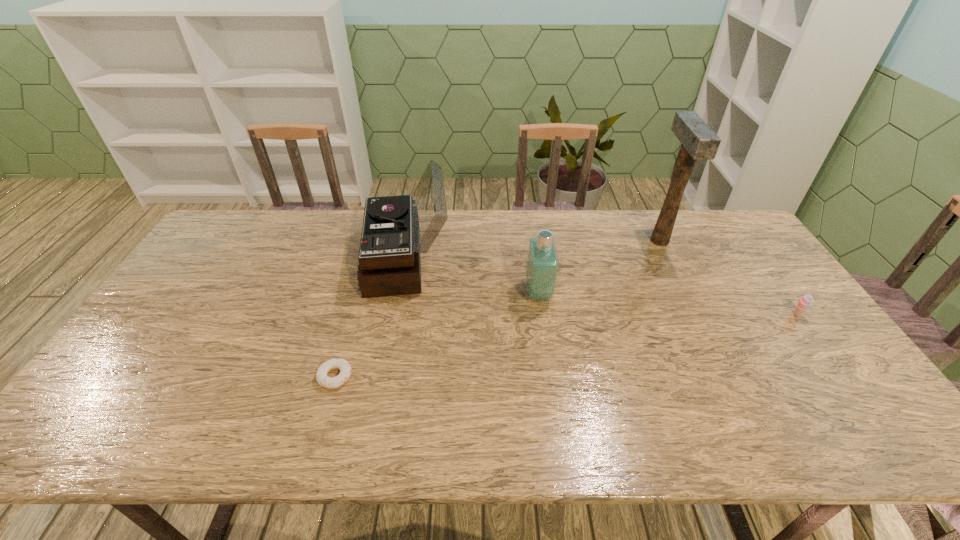
Locate an element on the screen. vacant position in the image that satisfies the following two spatial constraints: 1. on the front label of the sherbert; 2. on the left side of the third object from left to right is located at coordinates (541, 315).

Where is `blank space that satisfies the following two spatial constraints: 1. on the front side of the record player; 2. on the left side of the sherbert`? blank space that satisfies the following two spatial constraints: 1. on the front side of the record player; 2. on the left side of the sherbert is located at coordinates (396, 315).